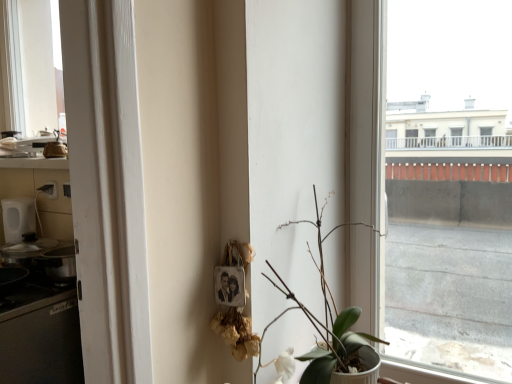
Question: From their relative heights in the image, would you say green matte plant at lower left is taller or shorter than transparent glass window at center?

Choices:
 (A) short
 (B) tall

Answer: (A)

Question: In the image, is green matte plant at lower left positioned in front of or behind transparent glass window at center?

Choices:
 (A) behind
 (B) front

Answer: (B)

Question: Considering the positions of green matte plant at lower left and transparent glass window at center in the image, is green matte plant at lower left wider or thinner than transparent glass window at center?

Choices:
 (A) thin
 (B) wide

Answer: (B)

Question: From a real-world perspective, relative to green matte plant at lower left, is transparent glass window at center vertically above or below?

Choices:
 (A) below
 (B) above

Answer: (B)

Question: Considering the positions of transparent glass window at center and green matte plant at lower left in the image, is transparent glass window at center bigger or smaller than green matte plant at lower left?

Choices:
 (A) small
 (B) big

Answer: (A)

Question: Would you say transparent glass window at center is inside or outside green matte plant at lower left?

Choices:
 (A) outside
 (B) inside

Answer: (A)

Question: Looking at their shapes, would you say transparent glass window at center is wider or thinner than green matte plant at lower left?

Choices:
 (A) thin
 (B) wide

Answer: (A)